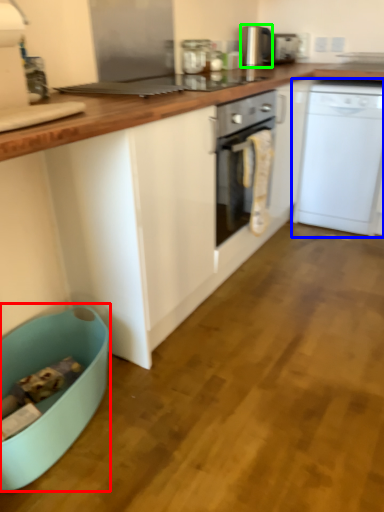
Question: Which object is the closest to the dish washer (highlighted by a red box)? Choose among these: home appliance (highlighted by a blue box) or kitchen appliance (highlighted by a green box).

Choices:
 (A) home appliance
 (B) kitchen appliance

Answer: (A)